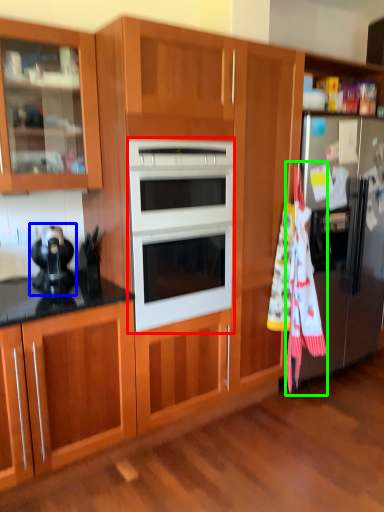
Question: Which object is positioned farthest from microwave oven (highlighted by a red box)? Select from appliance (highlighted by a blue box) and beach towel (highlighted by a green box).

Choices:
 (A) appliance
 (B) beach towel

Answer: (B)